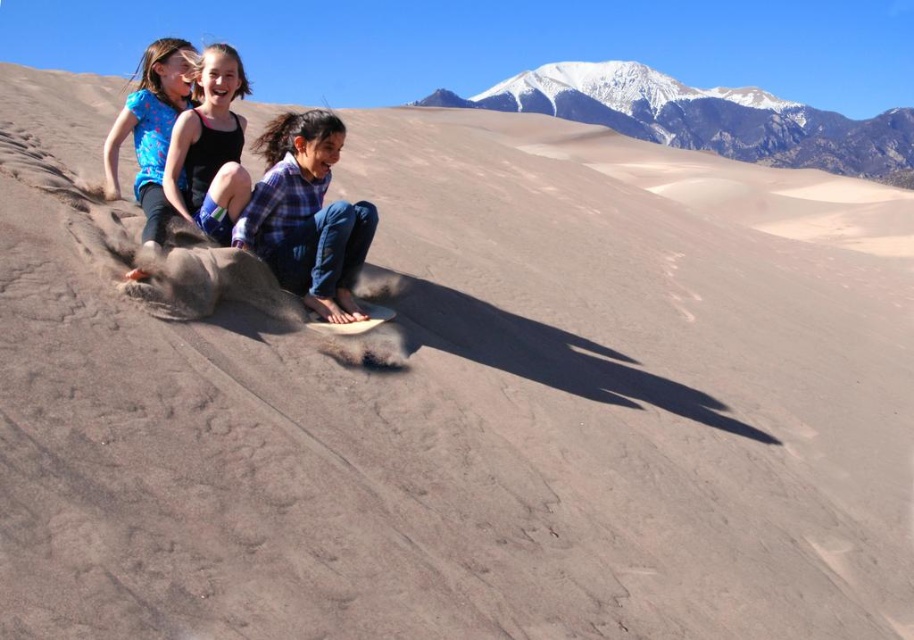
You are a photographer trying to capture the children playing at Great Sand Dunes National Park. You notice the matte blue shorts at center and the matte blue shirt at upper left in your viewfinder. Which object should you focus on if you want to highlight something that takes up more visual area in the photo?

The matte blue shirt at upper left occupies more space than the matte blue shorts at center, so focusing on the matte blue shirt at upper left would highlight the larger visual area.

You are a hiker who wants to take a photo of the snowy mountain at upper center from where the blue plaid shirt at center is located. Considering the distance between them, would you need a telephoto lens to capture the entire mountain in your shot?

The distance between the snowy mountain at upper center and the blue plaid shirt at center is 183.44 meters. To capture the entire mountain from that distance, a telephoto lens would be necessary to avoid cropping the mountain out of the frame.